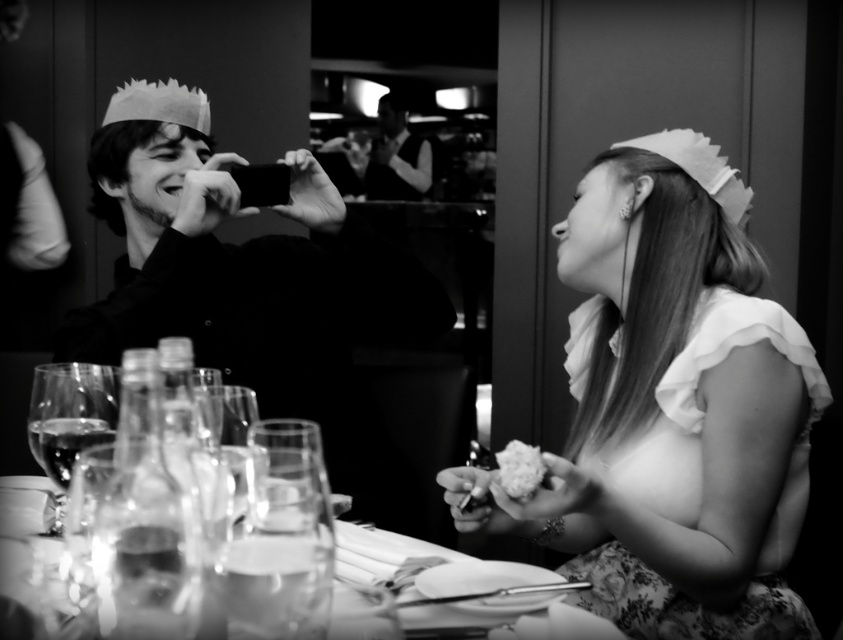
Question: Among these objects, which one is farthest from the camera?

Choices:
 (A) white fluffy cake at lower center
 (B) clear glassware at center
 (C) smooth black shirt at center
 (D) smooth black shirt at left

Answer: (C)

Question: Does clear glass wine glass at lower left appear over white fluffy cake at lower center?

Choices:
 (A) no
 (B) yes

Answer: (B)

Question: Can you confirm if clear glass wine glass at lower left is positioned below white fluffy cake at lower center?

Choices:
 (A) yes
 (B) no

Answer: (B)

Question: Which of the following is the farthest from the observer?

Choices:
 (A) (513, 451)
 (B) (680, 620)
 (C) (519, 636)
 (D) (395, 192)

Answer: (D)

Question: Observing the image, what is the correct spatial positioning of white satin dress at right in reference to clear glassware at center?

Choices:
 (A) left
 (B) right

Answer: (B)

Question: Considering the real-world distances, which object is farthest from the smooth black shirt at left?

Choices:
 (A) white satin dress at right
 (B) smooth black shirt at center
 (C) clear glassware at center
 (D) white fluffy cake at lower center

Answer: (B)